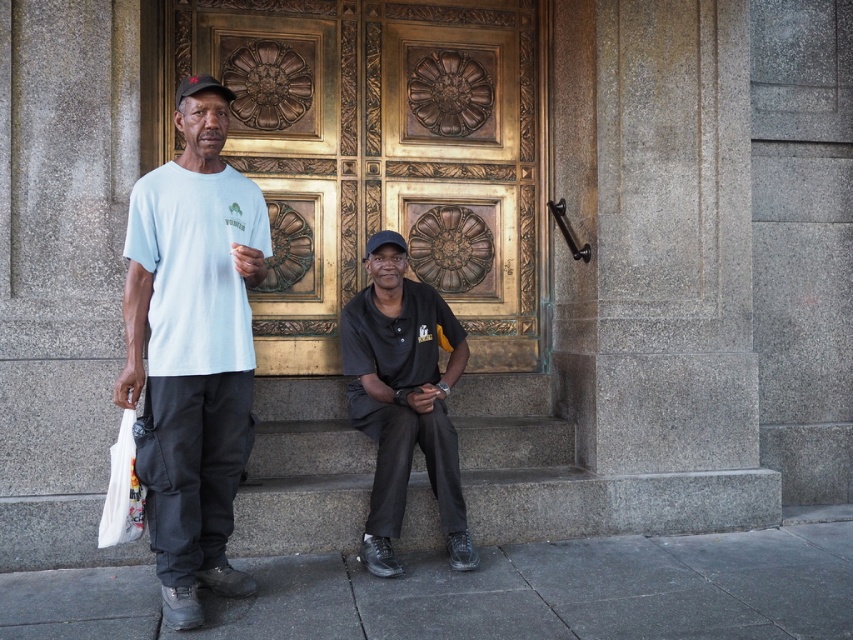
This screenshot has width=853, height=640. What do you see at coordinates (403, 403) in the screenshot?
I see `black matte shirt at center` at bounding box center [403, 403].

Is black matte shirt at center wider than black fabric baseball cap at center?

Correct, the width of black matte shirt at center exceeds that of black fabric baseball cap at center.

Is point (425, 364) positioned in front of point (395, 237)?

Yes, it is.

At what (x,y) coordinates should I click in order to perform the action: click on black matte shirt at center. Please return your answer as a coordinate pair (x, y). This screenshot has width=853, height=640. Looking at the image, I should click on (403, 403).

Who is positioned more to the right, gold polished wood door at center or black matte shirt at center?

black matte shirt at center

Measure the distance from gold polished wood door at center to black matte shirt at center.

gold polished wood door at center and black matte shirt at center are 1.27 meters apart from each other.

Is point (416, 227) positioned behind point (374, 372)?

Yes.

The image size is (853, 640). In order to click on gold polished wood door at center in this screenshot , I will do `click(381, 156)`.

Consider the image. Is gray concrete stairs at lower center wider than black matte shirt at center?

Yes.

Between point (492, 465) and point (407, 461), which one is positioned in front?

Positioned in front is point (407, 461).

Is point (364, 493) positioned behind point (379, 340)?

No, (364, 493) is in front of (379, 340).

Find the location of a particular element. The width and height of the screenshot is (853, 640). gray concrete stairs at lower center is located at coordinates (579, 476).